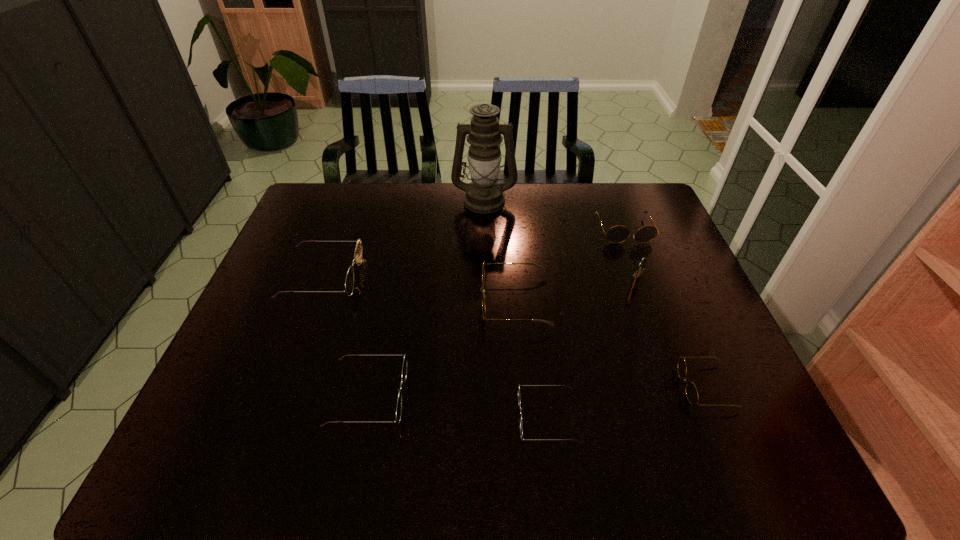
Find the location of a particular element. This screenshot has width=960, height=540. object positioned at the near edge is located at coordinates (519, 401).

The image size is (960, 540). Identify the location of object present at the left edge. (358, 253).

Where is `padlock present at the right edge`? Image resolution: width=960 pixels, height=540 pixels. padlock present at the right edge is located at coordinates (636, 279).

Locate an element on the screen. This screenshot has width=960, height=540. object present at the far right corner is located at coordinates (617, 234).

You are a GUI agent. You are given a task and a screenshot of the screen. Output one action in this format:
    pyautogui.click(x=<x>, y=<y>)
    Task: Click on the vacant space at the far edge of the desktop
    Image resolution: width=960 pixels, height=540 pixels.
    Given the screenshot: What is the action you would take?
    pyautogui.click(x=595, y=202)

What are the coordinates of `vacant space at the near edge of the desktop` in the screenshot? It's located at (553, 435).

In the image, there is a desktop. Identify the location of vacant space at the left edge. The width and height of the screenshot is (960, 540). (306, 257).

Where is `vacant space at the right edge of the desktop`? The height and width of the screenshot is (540, 960). vacant space at the right edge of the desktop is located at coordinates (708, 366).

What are the coordinates of `free space at the far right corner` in the screenshot? It's located at (638, 204).

In the image, there is a desktop. Where is `free space at the near right corner`? Image resolution: width=960 pixels, height=540 pixels. free space at the near right corner is located at coordinates (732, 437).